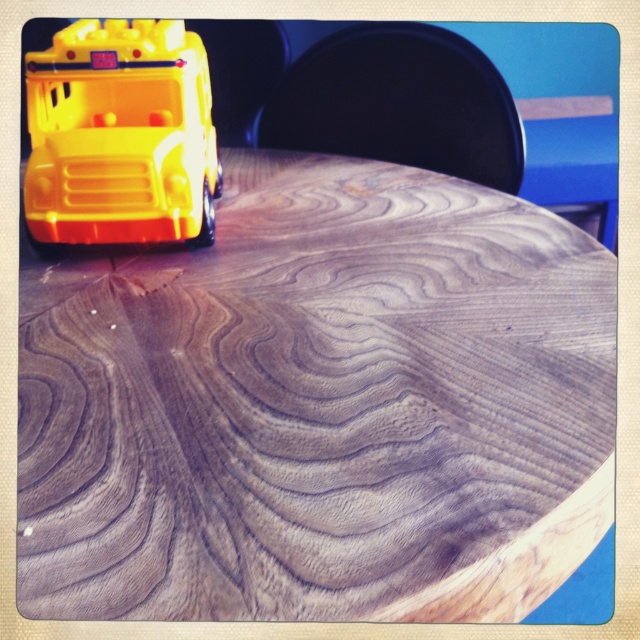
Question: Which object is closer to the camera taking this photo?

Choices:
 (A) wooden table at upper left
 (B) yellow plastic toy bus at upper left

Answer: (A)

Question: Is wooden table at upper left above yellow plastic toy bus at upper left?

Choices:
 (A) yes
 (B) no

Answer: (B)

Question: Which point is closer to the camera taking this photo?

Choices:
 (A) (362, 276)
 (B) (88, 81)

Answer: (B)

Question: Does wooden table at upper left appear on the left side of yellow plastic toy bus at upper left?

Choices:
 (A) yes
 (B) no

Answer: (B)

Question: Can you confirm if wooden table at upper left is thinner than yellow plastic toy bus at upper left?

Choices:
 (A) no
 (B) yes

Answer: (A)

Question: Which object is farther from the camera taking this photo?

Choices:
 (A) yellow plastic toy bus at upper left
 (B) wooden table at upper left

Answer: (A)